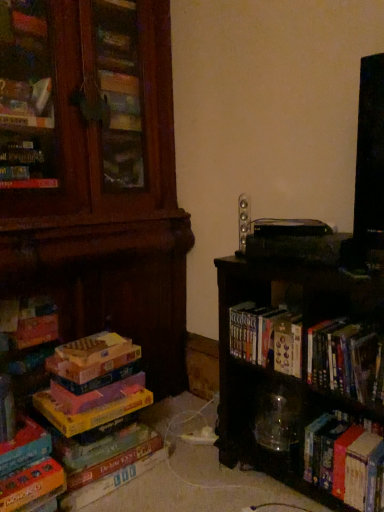
Question: Does hardcover books at center, marked as the 3th book in a left-to-right arrangement, appear on the right side of black matte bookshelf at right?

Choices:
 (A) no
 (B) yes

Answer: (A)

Question: Considering the relative sizes of hardcover books at center, marked as the 3th book in a left-to-right arrangement, and black matte bookshelf at right in the image provided, is hardcover books at center, marked as the 3th book in a left-to-right arrangement, smaller than black matte bookshelf at right?

Choices:
 (A) yes
 (B) no

Answer: (A)

Question: Is black matte bookshelf at right surrounded by hardcover books at center, marked as the 3th book in a left-to-right arrangement?

Choices:
 (A) yes
 (B) no

Answer: (B)

Question: From a real-world perspective, is hardcover books at center, marked as the 3th book in a left-to-right arrangement, beneath black matte bookshelf at right?

Choices:
 (A) yes
 (B) no

Answer: (B)

Question: Does hardcover books at center, arranged as the third book when viewed from the right, have a larger size compared to black matte bookshelf at right?

Choices:
 (A) no
 (B) yes

Answer: (A)

Question: Is point (355, 467) positioned closer to the camera than point (243, 202)?

Choices:
 (A) closer
 (B) farther

Answer: (A)

Question: In terms of size, does hardcover book at lower right, the 5th book when ordered from left to right, appear bigger or smaller than satin silver speaker at upper center?

Choices:
 (A) small
 (B) big

Answer: (B)

Question: From the image's perspective, relative to satin silver speaker at upper center, is hardcover book at lower right, positioned as the 1th book in right-to-left order, above or below?

Choices:
 (A) above
 (B) below

Answer: (B)

Question: Would you say hardcover book at lower right, the 5th book when ordered from left to right, is inside or outside satin silver speaker at upper center?

Choices:
 (A) inside
 (B) outside

Answer: (B)

Question: Is satin silver speaker at upper center in front of or behind black matte bookshelf at right in the image?

Choices:
 (A) front
 (B) behind

Answer: (B)

Question: Is satin silver speaker at upper center taller or shorter than black matte bookshelf at right?

Choices:
 (A) short
 (B) tall

Answer: (A)

Question: From the image's perspective, is satin silver speaker at upper center located above or below black matte bookshelf at right?

Choices:
 (A) below
 (B) above

Answer: (B)

Question: In terms of width, does satin silver speaker at upper center look wider or thinner when compared to black matte bookshelf at right?

Choices:
 (A) wide
 (B) thin

Answer: (B)

Question: From the image's perspective, is hardcover books at center, arranged as the third book when viewed from the right, positioned above or below multicolored cardboard at left, arranged as the 2th book when viewed from the left?

Choices:
 (A) above
 (B) below

Answer: (A)

Question: Based on their sizes in the image, would you say hardcover books at center, marked as the 3th book in a left-to-right arrangement, is bigger or smaller than multicolored cardboard at left, the fourth book from the right?

Choices:
 (A) big
 (B) small

Answer: (B)